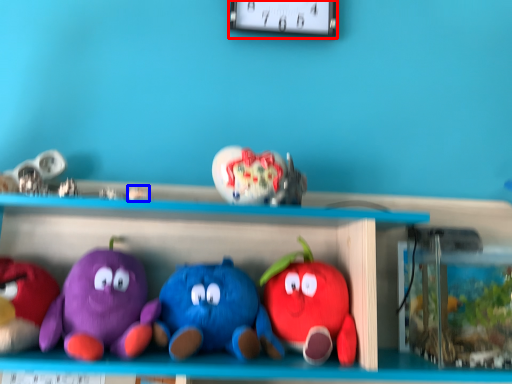
Question: Which object appears closest to the camera in this image, clock (highlighted by a red box) or toy (highlighted by a blue box)?

Choices:
 (A) clock
 (B) toy

Answer: (B)